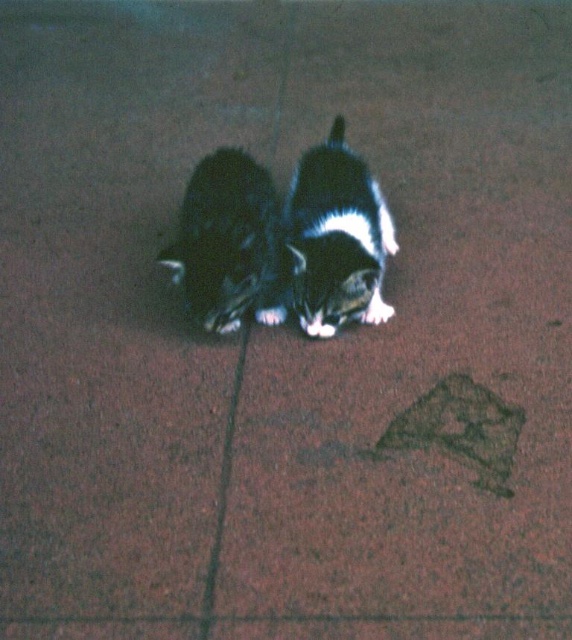
You are standing in a room with two small dogs lying side by side on a reddish brown tiled floor. You notice a point marked at coordinate (331, 243). What animal is located at that point?

The point at coordinate (331, 243) marks a black and white fur cat at center.

You are a photographer trying to capture a closeup of the black fur cat at center without including the black and white fur cat at center in the frame. Given their positions, is this possible?

The black and white fur cat at center is to the right of the black fur cat at center. Since they are positioned side by side with the black and white one on the right, you can adjust your camera angle to focus solely on the black fur cat at center by moving your camera to the left side, ensuring the rightmost cat is out of frame.